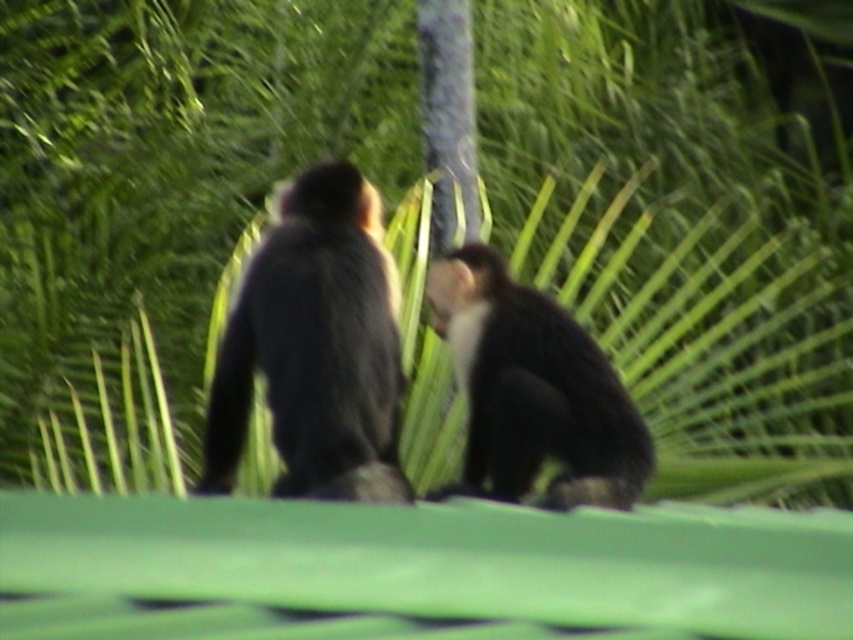
You are a wildlife photographer aiming to capture a closeup shot of both the black furry monkey at center and the black fur tail at left. Your camera has a maximum focus range of 20 inches. Can you fit both subjects within the camera frame without moving your position?

The distance between the black furry monkey at center and the black fur tail at left is 20.69 inches, which exceeds the camera maximum focus range of 20 inches. Therefore, you cannot fit both subjects within the camera frame without moving your position.

You are a wildlife photographer aiming to capture a closeup shot of the dark fur monkey at center. Based on its coordinates, can you determine if it is positioned centrally within the frame?

The dark fur monkey at center is located at point coordinates (315, 348), which is very close to the center of the frame. This positioning allows for an effective closeup shot as it is nearly centered.